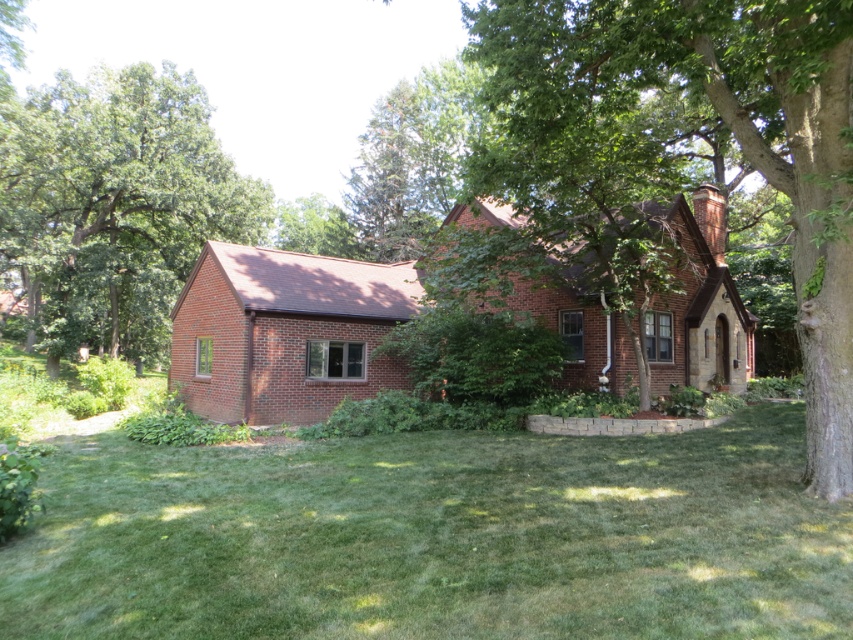
Question: Considering the relative positions of green leafy tree at center and green leafy tree at left in the image provided, where is green leafy tree at center located with respect to green leafy tree at left?

Choices:
 (A) above
 (B) below

Answer: (A)

Question: Which object is positioned farthest from the green grass at lower center?

Choices:
 (A) green leafy tree at center
 (B) green leafy tree at left

Answer: (B)

Question: Is green grass at lower center above green leafy tree at left?

Choices:
 (A) no
 (B) yes

Answer: (A)

Question: Can you confirm if green leafy tree at center is wider than green leafy tree at left?

Choices:
 (A) no
 (B) yes

Answer: (A)

Question: Which point appears closest to the camera in this image?

Choices:
 (A) (358, 625)
 (B) (122, 330)
 (C) (543, 93)

Answer: (A)

Question: Estimate the real-world distances between objects in this image. Which object is closer to the green leafy tree at left?

Choices:
 (A) green leafy tree at center
 (B) green grass at lower center

Answer: (B)